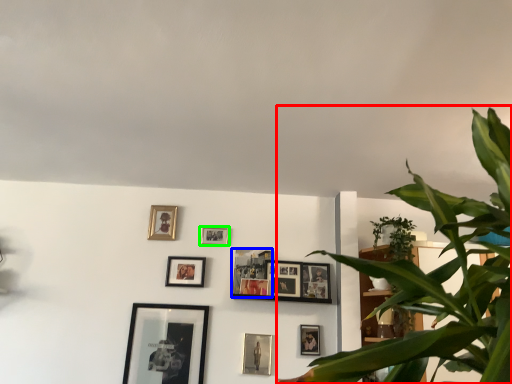
Question: Which is farther away from houseplant (highlighted by a red box)? picture frame (highlighted by a blue box) or picture frame (highlighted by a green box)?

Choices:
 (A) picture frame
 (B) picture frame

Answer: (B)